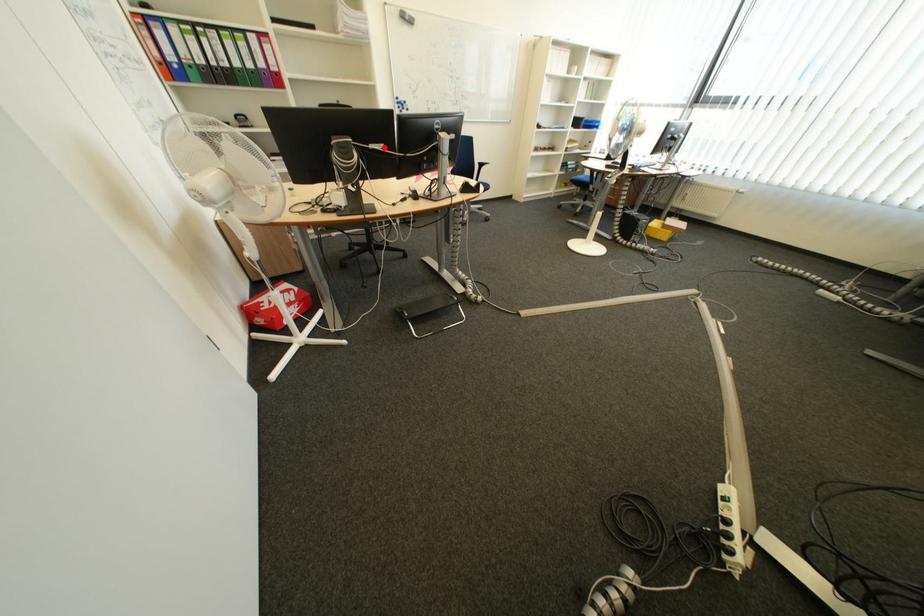
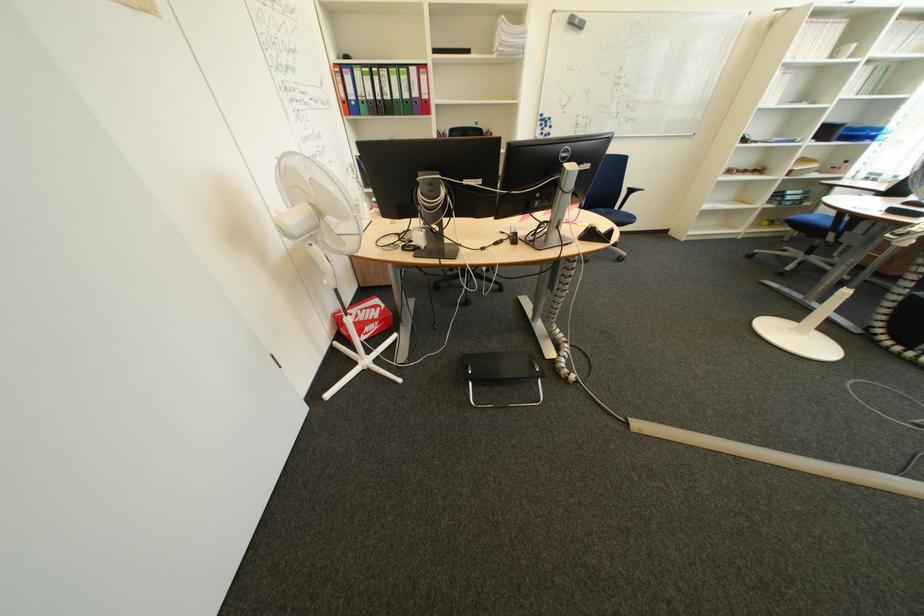
Where in the second image is the point corresponding to the highlighted location from the first image?

(479, 184)